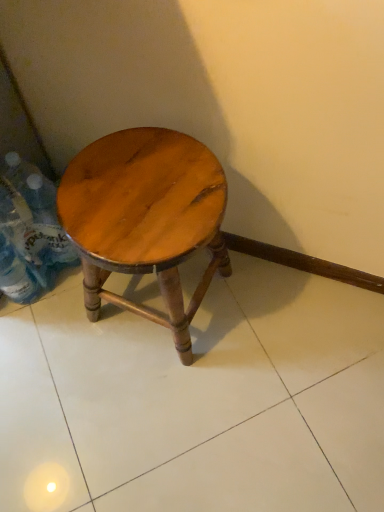
At what (x,y) coordinates should I click in order to perform the action: click on vacant space in front of wooden stool at center. Please return your answer as a coordinate pair (x, y). Looking at the image, I should click on (153, 401).